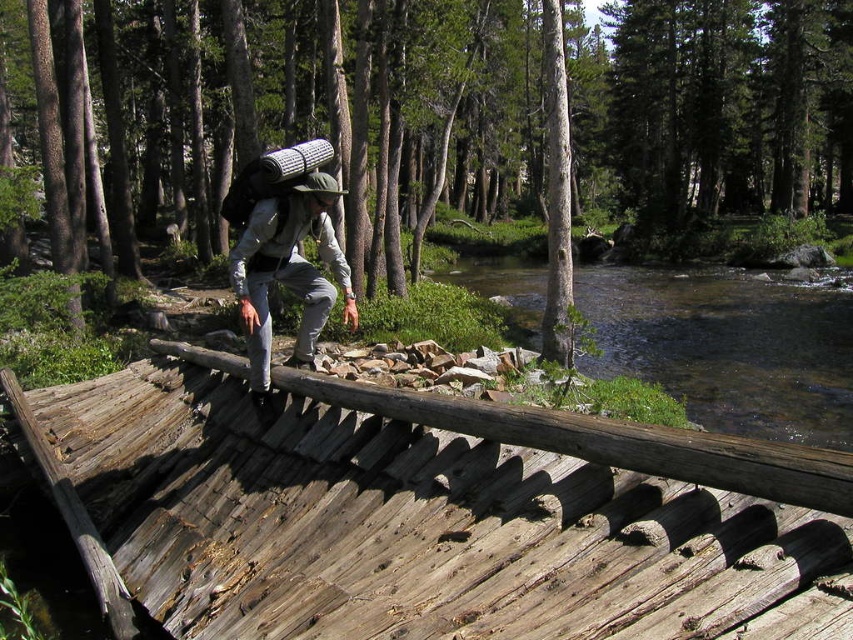
You are the hiker in the scene and need to retrieve your water bottle from the clear water at river right. Which direction should you move relative to your gray fabric backpack at center?

The clear water at river right is to the right of the gray fabric backpack at center, so you should move to the right of your gray fabric backpack at center to reach it.

You are the hiker in the image. You want to place your gray fabric backpack at center on the weathered wood bridge at center. Is the bridge in front of or behind the backpack?

The weathered wood bridge at center is in front of the gray fabric backpack at center, so the backpack is behind the bridge. Therefore, placing the backpack on the bridge would require moving it forward to the bridge.